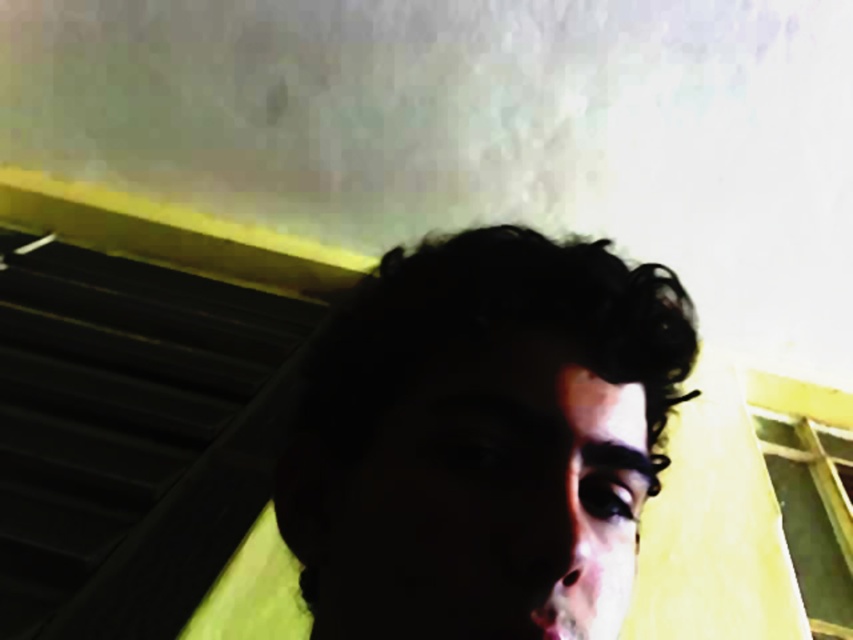
You are a GUI agent. You are given a task and a screenshot of the screen. Output one action in this format:
    pyautogui.click(x=<x>, y=<y>)
    Task: Click on the dark curly hair at center
    The width and height of the screenshot is (853, 640).
    Given the screenshot: What is the action you would take?
    pyautogui.click(x=482, y=440)

Find the location of `dark curly hair at center`. dark curly hair at center is located at coordinates (482, 440).

This screenshot has width=853, height=640. Find the location of `dark curly hair at center`. dark curly hair at center is located at coordinates (482, 440).